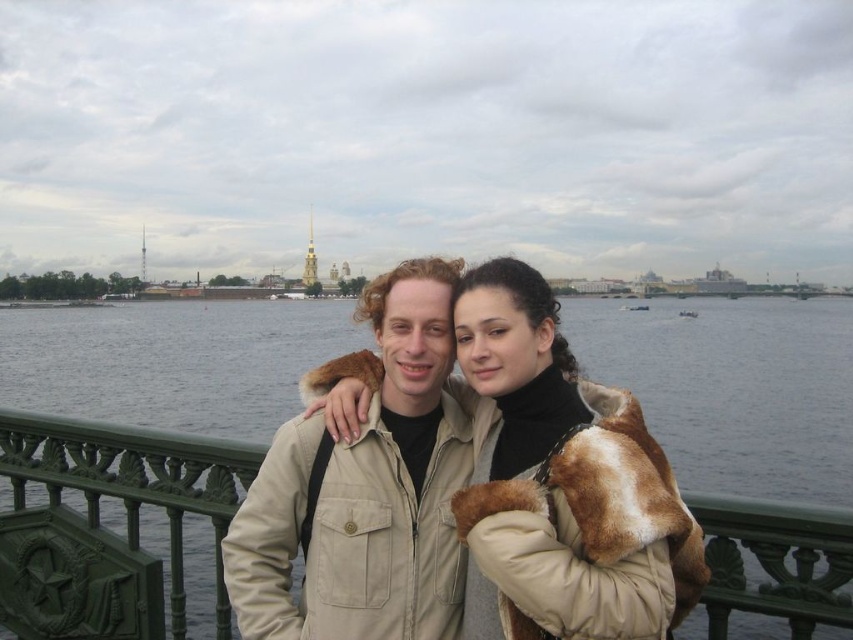
Can you confirm if fur-lined beige coat at center is shorter than beige fabric jacket at center?

Yes, fur-lined beige coat at center is shorter than beige fabric jacket at center.

Looking at this image, how much distance is there between fur-lined beige coat at center and beige fabric jacket at center?

5.99 meters

This screenshot has width=853, height=640. Find the location of `fur-lined beige coat at center`. fur-lined beige coat at center is located at coordinates (560, 483).

Who is positioned more to the right, beige fabric jacket at center or green metal railing at center?

Result: beige fabric jacket at center is more to the right.

Which is in front, point (378, 458) or point (163, 486)?

Point (378, 458) is in front.

Identify the location of beige fabric jacket at center. This screenshot has height=640, width=853. (364, 486).

Is point (641, 467) positioned behind point (828, 544)?

That is True.

Can you confirm if fur-lined beige coat at center is positioned below green metal railing at center?

Actually, fur-lined beige coat at center is above green metal railing at center.

Who is more distant from viewer, [474,410] or [828,616]?

The point [474,410] is behind.

Identify the location of fur-lined beige coat at center. The width and height of the screenshot is (853, 640). (560, 483).